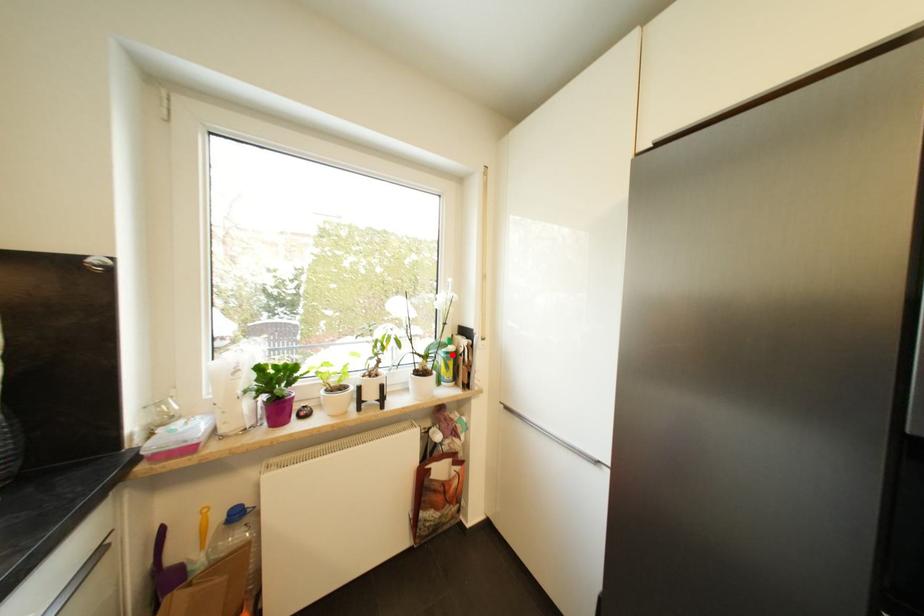
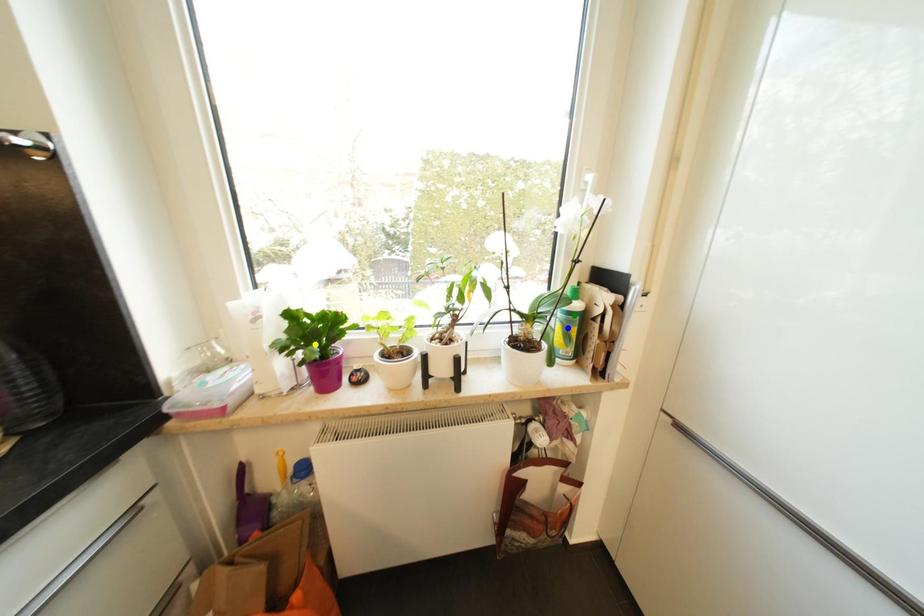
Question: I am providing you with two images of the same scene from different viewpoints. A red point is marked on the first image. You are given multiple points on the second image. Which point in image 2 represents the same 3d spot as the red point in image 1?

Choices:
 (A) green point
 (B) yellow point
 (C) blue point

Answer: (A)